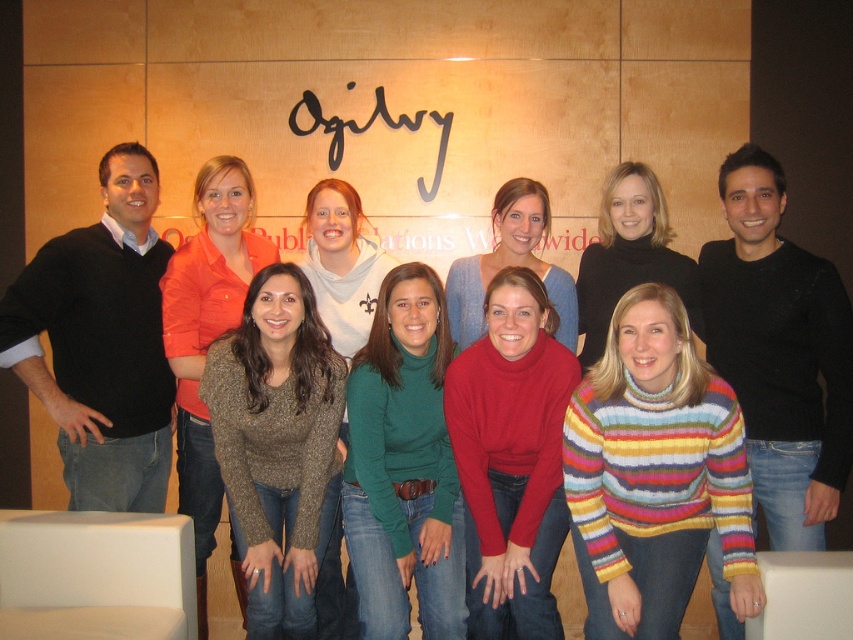
Question: Does matte orange shirt at center have a larger size compared to shiny gold sweater at center?

Choices:
 (A) yes
 (B) no

Answer: (A)

Question: Which of the following is the closest to the observer?

Choices:
 (A) (9, 342)
 (B) (404, 577)
 (C) (202, 445)

Answer: (B)

Question: Which object is the closest to the shiny gold sweater at center?

Choices:
 (A) black metal sign at upper center
 (B) black sweater at left
 (C) multicolored knitted sweater at center

Answer: (A)

Question: Is green turtleneck sweater at center above matte red turtleneck sweater at center?

Choices:
 (A) yes
 (B) no

Answer: (A)

Question: Is matte red turtleneck sweater at center closer to camera compared to black metal sign at upper center?

Choices:
 (A) no
 (B) yes

Answer: (B)

Question: Which object appears closest to the camera in this image?

Choices:
 (A) striped sweater at center
 (B) matte red turtleneck sweater at center

Answer: (B)